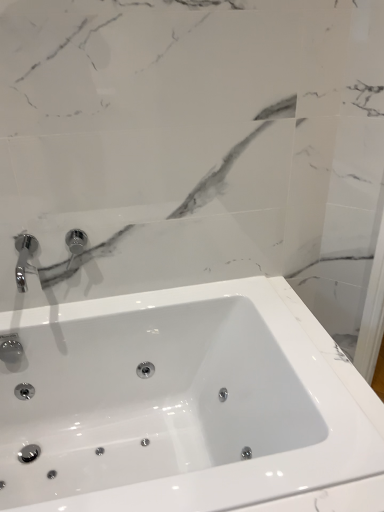
Image resolution: width=384 pixels, height=512 pixels. I want to click on chrome metallic faucet at upper left, so click(x=24, y=257).

Describe the element at coordinates (24, 257) in the screenshot. I see `chrome metallic faucet at upper left` at that location.

You are a GUI agent. You are given a task and a screenshot of the screen. Output one action in this format:
    pyautogui.click(x=<x>, y=<y>)
    Task: Click on the white glossy sink at center
    The image size is (384, 512).
    Given the screenshot: What is the action you would take?
    pyautogui.click(x=179, y=403)

The image size is (384, 512). What do you see at coordinates (179, 403) in the screenshot? I see `white glossy sink at center` at bounding box center [179, 403].

At what (x,y) coordinates should I click in order to perform the action: click on chrome metallic faucet at upper left. Please return your answer as a coordinate pair (x, y). Image resolution: width=384 pixels, height=512 pixels. Looking at the image, I should click on (24, 257).

Looking at this image, which is more to the left, white glossy sink at center or chrome metallic faucet at upper left?

chrome metallic faucet at upper left is more to the left.

Considering their positions, is white glossy sink at center located in front of or behind chrome metallic faucet at upper left?

white glossy sink at center is in front of chrome metallic faucet at upper left.

Is point (147, 382) farther from viewer compared to point (25, 278)?

Yes.

From the image's perspective, is white glossy sink at center below chrome metallic faucet at upper left?

Indeed, from the image's perspective, white glossy sink at center is shown beneath chrome metallic faucet at upper left.

From a real-world perspective, which object rests below the other?

From a 3D spatial view, white glossy sink at center is below.

From the picture: Between white glossy sink at center and chrome metallic faucet at upper left, which one has smaller width?

chrome metallic faucet at upper left is thinner.

Looking at this image, considering the relative sizes of white glossy sink at center and chrome metallic faucet at upper left in the image provided, is white glossy sink at center shorter than chrome metallic faucet at upper left?

No, white glossy sink at center is not shorter than chrome metallic faucet at upper left.

Is white glossy sink at center bigger or smaller than chrome metallic faucet at upper left?

In the image, white glossy sink at center appears to be larger than chrome metallic faucet at upper left.

Choose the correct answer: Is white glossy sink at center inside chrome metallic faucet at upper left or outside it?

white glossy sink at center is spatially situated outside chrome metallic faucet at upper left.

Is white glossy sink at center next to chrome metallic faucet at upper left?

There is a gap between white glossy sink at center and chrome metallic faucet at upper left.

Is white glossy sink at center positioned with its back to chrome metallic faucet at upper left?

No, white glossy sink at center is not facing away from chrome metallic faucet at upper left.

Can you tell me how much white glossy sink at center and chrome metallic faucet at upper left differ in facing direction?

The facing directions of white glossy sink at center and chrome metallic faucet at upper left are 0.741 degrees apart.

Measure the distance between white glossy sink at center and chrome metallic faucet at upper left.

white glossy sink at center is 22.81 inches from chrome metallic faucet at upper left.

Image resolution: width=384 pixels, height=512 pixels. In order to click on tap on the left of white glossy sink at center in this screenshot , I will do `click(24, 257)`.

Can you confirm if chrome metallic faucet at upper left is positioned to the right of white glossy sink at center?

No.

Considering the positions of objects chrome metallic faucet at upper left and white glossy sink at center in the image provided, who is behind, chrome metallic faucet at upper left or white glossy sink at center?

chrome metallic faucet at upper left is further away from the camera.

Considering the positions of points (24, 271) and (52, 500), is point (24, 271) farther from camera compared to point (52, 500)?

Yes, it is.

From the image's perspective, is chrome metallic faucet at upper left above white glossy sink at center?

Indeed, from the image's perspective, chrome metallic faucet at upper left is shown above white glossy sink at center.

Consider the image. From a real-world perspective, is chrome metallic faucet at upper left positioned above or below white glossy sink at center?

From a real-world perspective, chrome metallic faucet at upper left is physically above white glossy sink at center.

Between chrome metallic faucet at upper left and white glossy sink at center, which one has larger width?

With larger width is white glossy sink at center.

Considering the sizes of objects chrome metallic faucet at upper left and white glossy sink at center in the image provided, who is shorter, chrome metallic faucet at upper left or white glossy sink at center?

Standing shorter between the two is chrome metallic faucet at upper left.

Considering the sizes of chrome metallic faucet at upper left and white glossy sink at center in the image, is chrome metallic faucet at upper left bigger or smaller than white glossy sink at center?

Clearly, chrome metallic faucet at upper left is smaller in size than white glossy sink at center.

Is white glossy sink at center located within chrome metallic faucet at upper left?

No, chrome metallic faucet at upper left does not contain white glossy sink at center.

Is chrome metallic faucet at upper left far from white glossy sink at center?

No, chrome metallic faucet at upper left is not far away from white glossy sink at center.

Could you tell me if chrome metallic faucet at upper left is turned towards white glossy sink at center?

No, chrome metallic faucet at upper left does not turn towards white glossy sink at center.

You are a GUI agent. You are given a task and a screenshot of the screen. Output one action in this format:
    pyautogui.click(x=<x>, y=<y>)
    Task: Click on the tap lying above the white glossy sink at center (from the image's perspective)
    This screenshot has height=512, width=384.
    Given the screenshot: What is the action you would take?
    pyautogui.click(x=24, y=257)

The width and height of the screenshot is (384, 512). Identify the location of sink in front of the chrome metallic faucet at upper left. (179, 403).

Where is `tap on the left of white glossy sink at center`? This screenshot has width=384, height=512. tap on the left of white glossy sink at center is located at coordinates (24, 257).